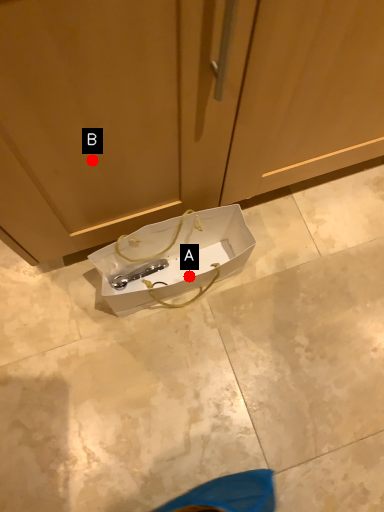
Question: Two points are circled on the image, labeled by A and B beside each circle. Which point is farther to the camera?

Choices:
 (A) A is further
 (B) B is further

Answer: (A)